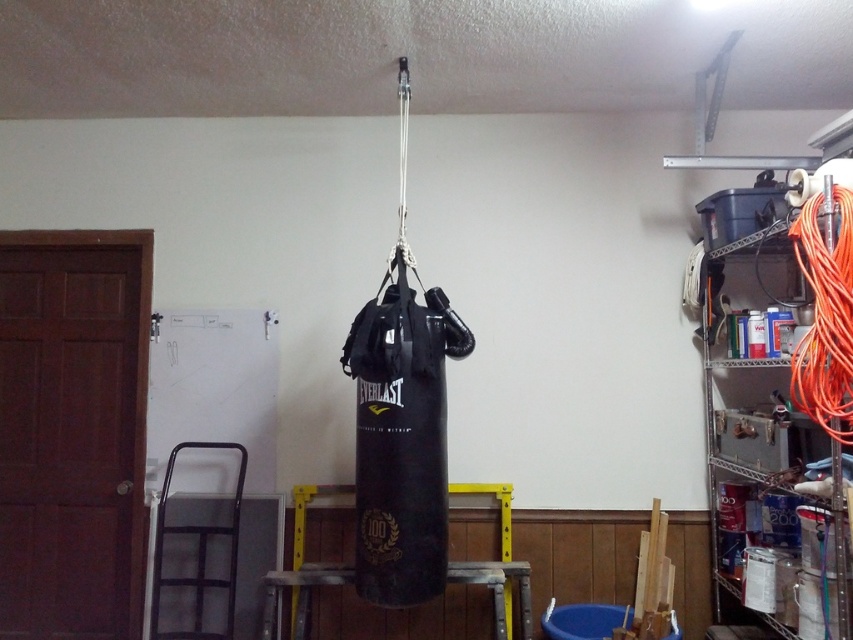
Is orange cable at right taller than metallic wire shelving at right?

No.

Which is in front, point (839, 424) or point (717, 417)?

Point (839, 424) is in front.

You are a GUI agent. You are given a task and a screenshot of the screen. Output one action in this format:
    pyautogui.click(x=<x>, y=<y>)
    Task: Click on the orange cable at right
    
    Given the screenshot: What is the action you would take?
    pyautogui.click(x=825, y=317)